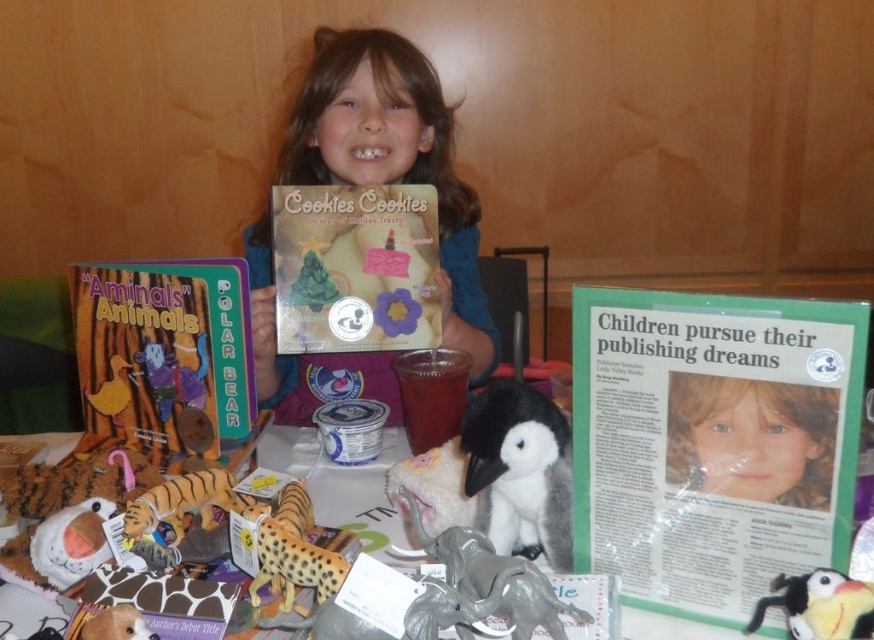
Does green paper poster at center appear under matte board book at left?

Yes.

Which is behind, point (699, 497) or point (198, 371)?

Point (198, 371)

Which is behind, point (685, 396) or point (231, 378)?

The point (231, 378) is behind.

Identify the location of green paper poster at center. The height and width of the screenshot is (640, 874). (712, 442).

Looking at this image, does green paper poster at center have a lesser width compared to black plush penguin at center?

Incorrect, green paper poster at center's width is not less than black plush penguin at center's.

Can you confirm if green paper poster at center is shorter than black plush penguin at center?

In fact, green paper poster at center may be taller than black plush penguin at center.

What do you see at coordinates (712, 442) in the screenshot? The width and height of the screenshot is (874, 640). I see `green paper poster at center` at bounding box center [712, 442].

Locate an element on the screen. The image size is (874, 640). green paper poster at center is located at coordinates pyautogui.click(x=712, y=442).

Does green paper poster at center have a smaller size compared to soft plush penguin at center?

Actually, green paper poster at center might be larger than soft plush penguin at center.

Who is positioned more to the left, green paper poster at center or soft plush penguin at center?

green paper poster at center

The width and height of the screenshot is (874, 640). Identify the location of green paper poster at center. (712, 442).